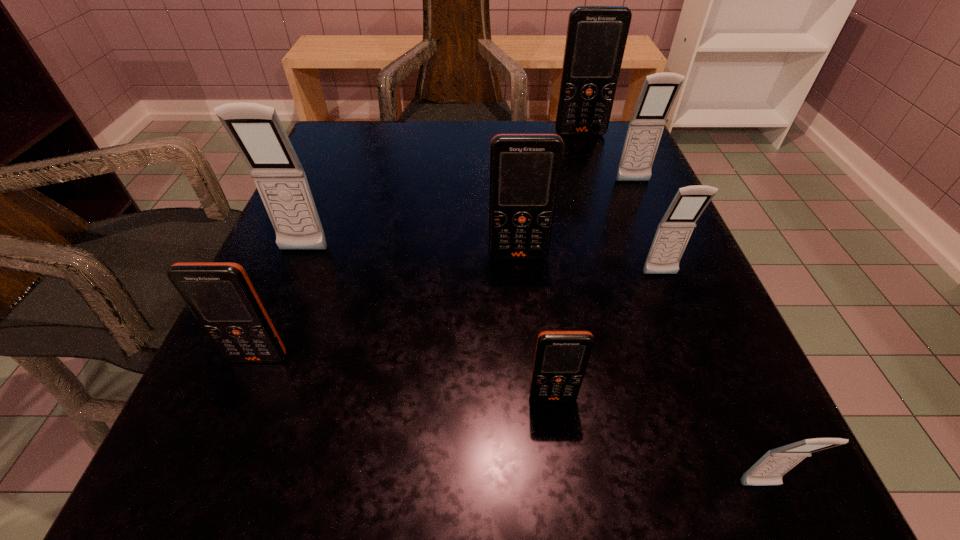
This screenshot has width=960, height=540. In order to click on free space at the far left corner in this screenshot , I will do `click(362, 161)`.

What are the coordinates of `vacant region at the far right corner of the desktop` in the screenshot? It's located at (626, 130).

The width and height of the screenshot is (960, 540). Find the location of `free spot at the near right corner of the desktop`. free spot at the near right corner of the desktop is located at coordinates (715, 469).

At what (x,y) coordinates should I click in order to perform the action: click on unoccupied area between the second smallest gray cellular telephone and the smallest orange cellular telephone. Please return your answer as a coordinate pair (x, y). This screenshot has height=540, width=960. Looking at the image, I should click on [607, 336].

Identify the location of free space that is in between the nearest gray cellular telephone and the nearest orange cellular telephone. This screenshot has width=960, height=540. (657, 442).

You are a GUI agent. You are given a task and a screenshot of the screen. Output one action in this format:
    pyautogui.click(x=<x>, y=<y>)
    Task: Click on the unoccupied position between the seventh farthest cellular telephone and the third biggest gray cellular telephone
    The width and height of the screenshot is (960, 540).
    Given the screenshot: What is the action you would take?
    pyautogui.click(x=607, y=336)

This screenshot has height=540, width=960. What are the coordinates of `free space that is in between the leftmost orange cellular telephone and the seventh farthest cellular telephone` in the screenshot? It's located at (406, 377).

What are the coordinates of `free space between the third smallest orange cellular telephone and the third farthest orange cellular telephone` in the screenshot? It's located at (389, 307).

At what (x,y) coordinates should I click in order to perform the action: click on vacant region between the farthest gray cellular telephone and the biggest gray cellular telephone. Please return your answer as a coordinate pair (x, y). The image size is (960, 540). Looking at the image, I should click on (468, 217).

Identify the location of empty space that is in between the biggest orange cellular telephone and the fifth farthest cellular telephone. (620, 205).